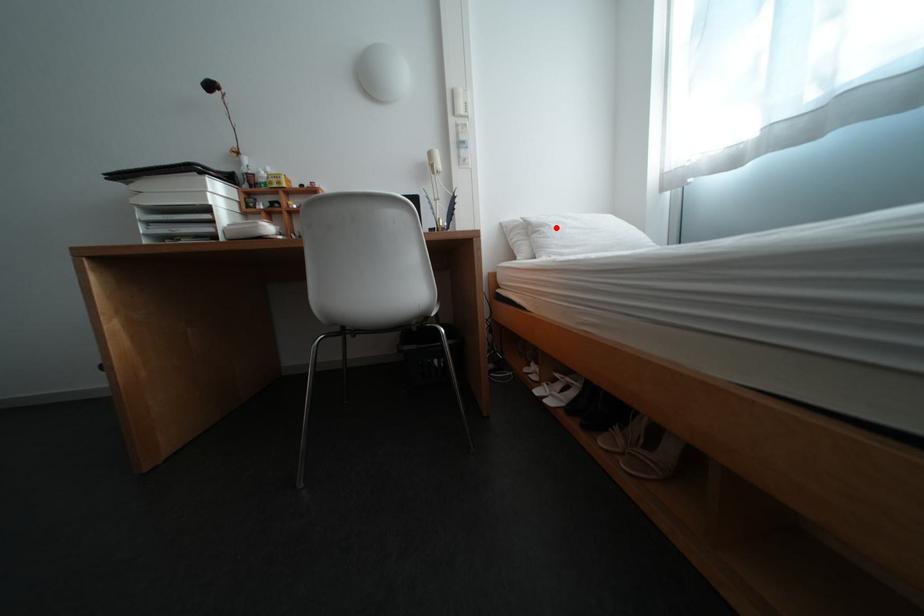
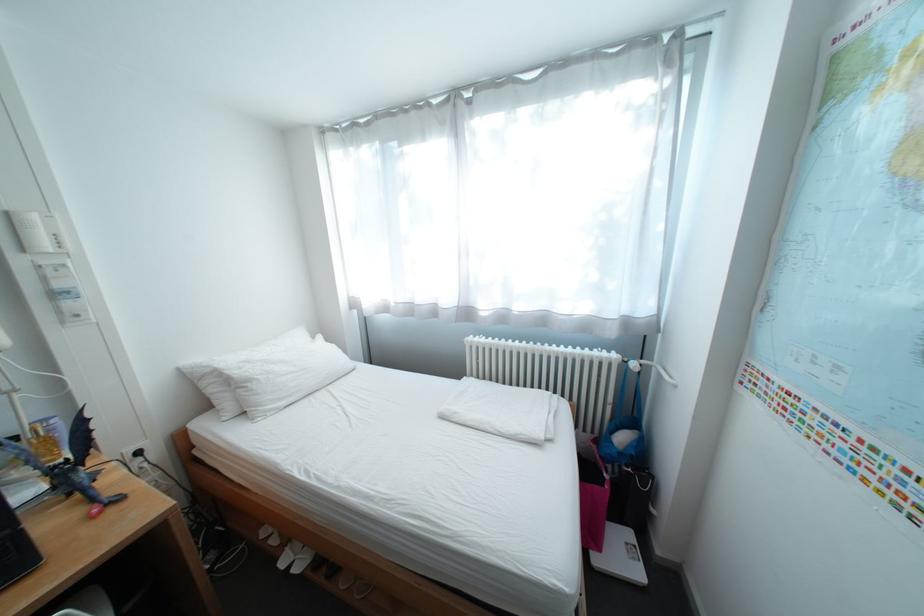
Where in the second image is the point corresponding to the highlighted location from the first image?

(263, 383)